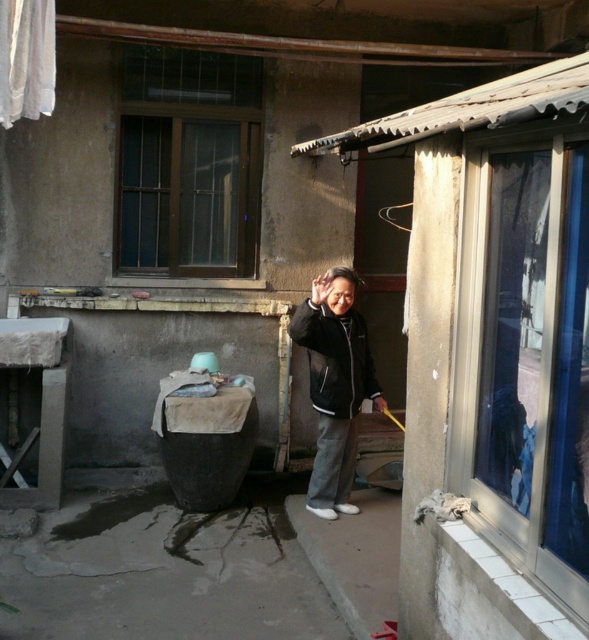
Question: Which point is closer to the camera?

Choices:
 (A) white fabric at upper left
 (B) transparent glass window at right
 (C) black matte jacket at center
 (D) dark brown wooden window at upper left

Answer: (B)

Question: Is black matte jacket at center wider than white fabric at upper left?

Choices:
 (A) no
 (B) yes

Answer: (B)

Question: Among these objects, which one is nearest to the camera?

Choices:
 (A) dark brown wooden window at upper left
 (B) transparent glass window at right
 (C) white fabric at upper left
 (D) black matte jacket at center

Answer: (B)

Question: Which is farther from the dark brown wooden window at upper left?

Choices:
 (A) transparent glass window at right
 (B) black matte jacket at center

Answer: (A)

Question: Does dark brown wooden window at upper left have a smaller size compared to black matte jacket at center?

Choices:
 (A) yes
 (B) no

Answer: (B)

Question: Does transparent glass window at right have a smaller size compared to white fabric at upper left?

Choices:
 (A) no
 (B) yes

Answer: (A)